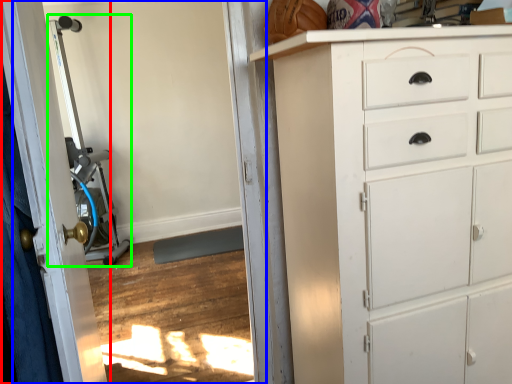
Question: Which is farther away from door (highlighted by a red box)? screen door (highlighted by a blue box) or sport equipment (highlighted by a green box)?

Choices:
 (A) screen door
 (B) sport equipment

Answer: (B)